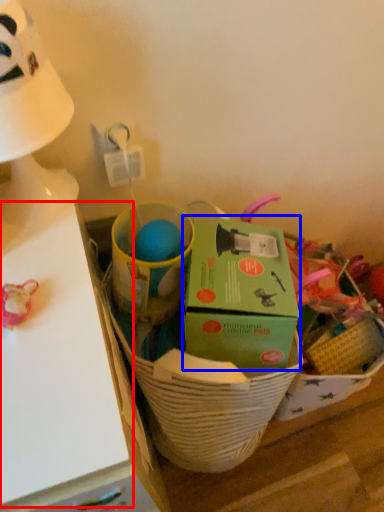
Question: Among these objects, which one is farthest to the camera, table (highlighted by a red box) or box (highlighted by a blue box)?

Choices:
 (A) table
 (B) box

Answer: (B)